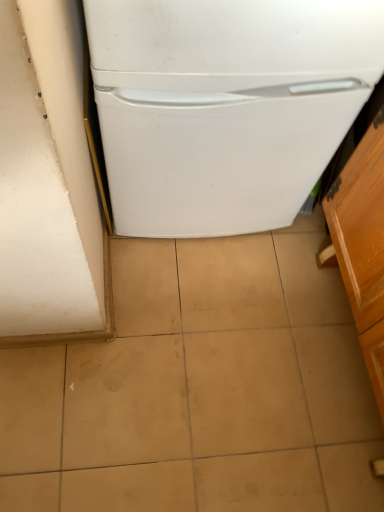
Question: Considering the positions of white matte refrigerator at center and wooden cabinet at right in the image, is white matte refrigerator at center wider or thinner than wooden cabinet at right?

Choices:
 (A) thin
 (B) wide

Answer: (B)

Question: Is white matte refrigerator at center in front of or behind wooden cabinet at right in the image?

Choices:
 (A) behind
 (B) front

Answer: (A)

Question: From a real-world perspective, is white matte refrigerator at center positioned above or below wooden cabinet at right?

Choices:
 (A) below
 (B) above

Answer: (B)

Question: Considering the relative positions of wooden cabinet at right and white matte refrigerator at center in the image provided, is wooden cabinet at right to the left or to the right of white matte refrigerator at center?

Choices:
 (A) right
 (B) left

Answer: (A)

Question: Is wooden cabinet at right situated inside white matte refrigerator at center or outside?

Choices:
 (A) outside
 (B) inside

Answer: (A)

Question: From their relative heights in the image, would you say wooden cabinet at right is taller or shorter than white matte refrigerator at center?

Choices:
 (A) short
 (B) tall

Answer: (A)

Question: Considering their positions, is wooden cabinet at right located in front of or behind white matte refrigerator at center?

Choices:
 (A) front
 (B) behind

Answer: (A)